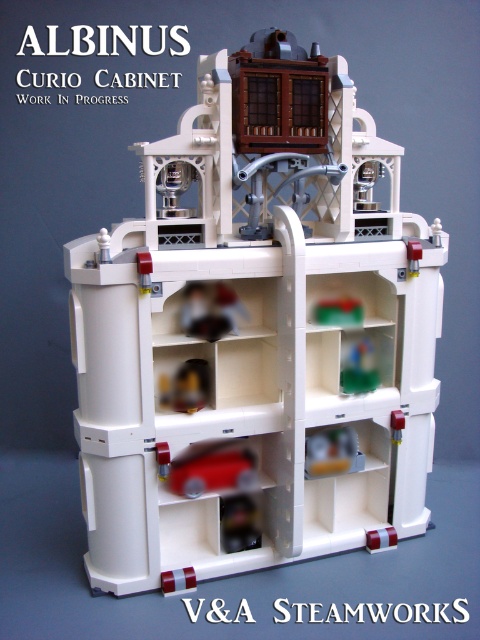
Is point (236, 332) positioned after point (373, 372)?

That is False.

Is point (197, 332) behind point (375, 369)?

No, it is in front of (375, 369).

You are a GUI agent. You are given a task and a screenshot of the screen. Output one action in this format:
    pyautogui.click(x=<x>, y=<y>)
    Task: Click on the matte white car at center
    The width and height of the screenshot is (480, 640).
    Given the screenshot: What is the action you would take?
    pyautogui.click(x=211, y=310)

Who is more forward, (365,390) or (348,320)?

Point (365,390) is more forward.

Can you confirm if translucent green glass at center is positioned to the left of green plastic toy at center?

Incorrect, translucent green glass at center is not on the left side of green plastic toy at center.

At what (x,y) coordinates should I click in order to perform the action: click on translucent green glass at center. Please return your answer as a coordinate pair (x, y). Looking at the image, I should click on (360, 369).

I want to click on translucent green glass at center, so click(x=360, y=369).

This screenshot has height=640, width=480. What do you see at coordinates (186, 387) in the screenshot? I see `matte plastic toy car at lower center` at bounding box center [186, 387].

Can you confirm if matte plastic toy car at lower center is positioned below green plastic toy at center?

Indeed, matte plastic toy car at lower center is positioned under green plastic toy at center.

What are the coordinates of `matte plastic toy car at lower center` in the screenshot? It's located at (186, 387).

The width and height of the screenshot is (480, 640). Find the location of `matte plastic toy car at lower center`. matte plastic toy car at lower center is located at coordinates (186, 387).